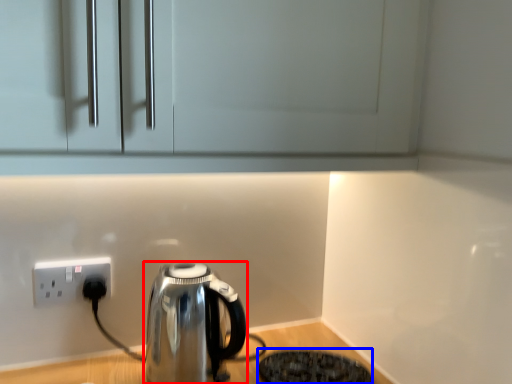
Question: Which of the following is the farthest to the observer, kettle (highlighted by a red box) or appliance (highlighted by a blue box)?

Choices:
 (A) kettle
 (B) appliance

Answer: (B)